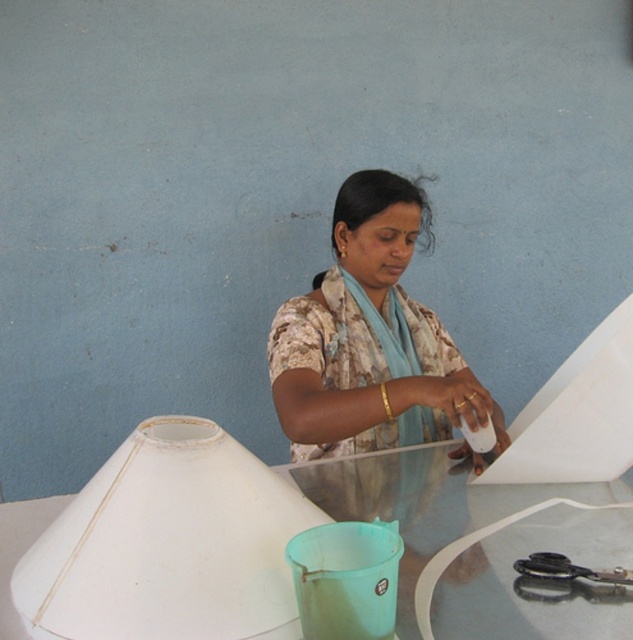
The height and width of the screenshot is (640, 633). What do you see at coordinates (536, 582) in the screenshot?
I see `transparent glass table at center` at bounding box center [536, 582].

Which is below, transparent glass table at center or black plastic scissors at lower right?

black plastic scissors at lower right is lower down.

Is point (463, 561) in front of point (589, 570)?

That is False.

The width and height of the screenshot is (633, 640). In order to click on transparent glass table at center in this screenshot , I will do `click(536, 582)`.

Can you confirm if matte floral shirt at center is positioned to the left of black plastic scissors at lower right?

Yes, matte floral shirt at center is to the left of black plastic scissors at lower right.

Can you confirm if matte floral shirt at center is positioned to the right of black plastic scissors at lower right?

No, matte floral shirt at center is not to the right of black plastic scissors at lower right.

Locate an element on the screen. matte floral shirt at center is located at coordinates (370, 339).

The image size is (633, 640). I want to click on matte floral shirt at center, so click(x=370, y=339).

Measure the distance from matte floral shirt at center to transparent glass table at center.

12.01 inches

Does matte floral shirt at center have a smaller size compared to transparent glass table at center?

No.

Between point (408, 419) and point (441, 637), which one is positioned behind?

The point (408, 419) is behind.

Locate an element on the screen. This screenshot has width=633, height=640. matte floral shirt at center is located at coordinates click(x=370, y=339).